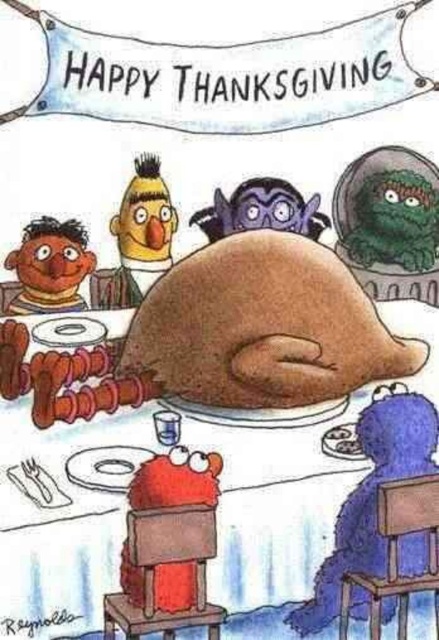
Question: Which point is farther from the camera taking this photo?

Choices:
 (A) (x=338, y=221)
 (B) (x=226, y=333)

Answer: (A)

Question: Is brown matte turkey at center wider than purple matte bat at upper center?

Choices:
 (A) yes
 (B) no

Answer: (A)

Question: Which point is farther to the camera?

Choices:
 (A) (234, 209)
 (B) (413, 436)
 (C) (169, 362)

Answer: (A)

Question: Which object is closer to the camera taking this photo?

Choices:
 (A) brown matte turkey at center
 (B) purple matte bat at upper center
 (C) brown matte ernie at lower left

Answer: (A)

Question: Is brown matte ernie at lower left below purple matte bat at upper center?

Choices:
 (A) yes
 (B) no

Answer: (A)

Question: Can you confirm if blue furry cookie monster at lower right is positioned below green fuzzy monster at upper right?

Choices:
 (A) no
 (B) yes

Answer: (B)